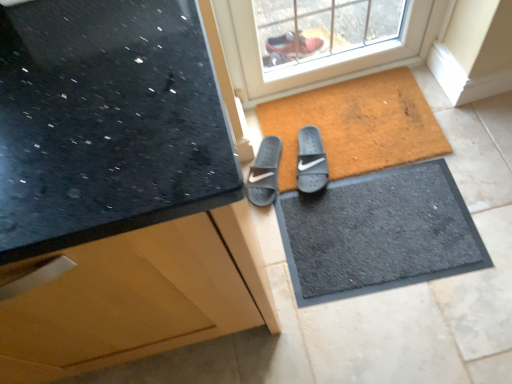
What are the coordinates of `free spot behind gray rubber slide at center, which is the 1th footwear in left-to-right order` in the screenshot? It's located at (264, 118).